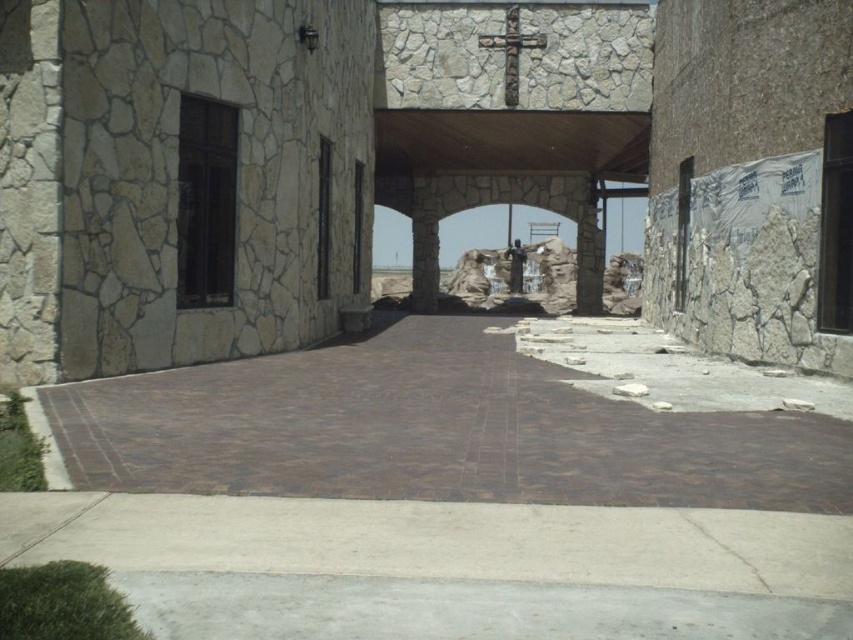
You are standing at the point marked by the coordinates point [405,160]. Looking at the building, which direction would you face to see the entrance archway?

Since the point [405,160] represents the natural stone chapel at center, standing at this point would mean you are at the center of the chapel. To see the entrance archway, you would face towards the front of the building, which is the direction the entrance faces. The entrance is part of the building, so facing forward from the center would align you with the entrance archway.